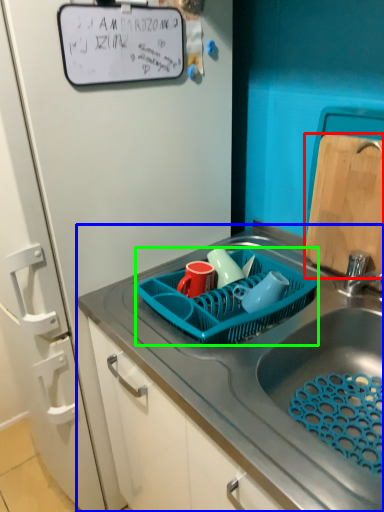
Question: Estimate the real-world distances between objects in this image. Which object is farther from cutting board (highlighted by a red box), sink (highlighted by a blue box) or basket (highlighted by a green box)?

Choices:
 (A) sink
 (B) basket

Answer: (A)